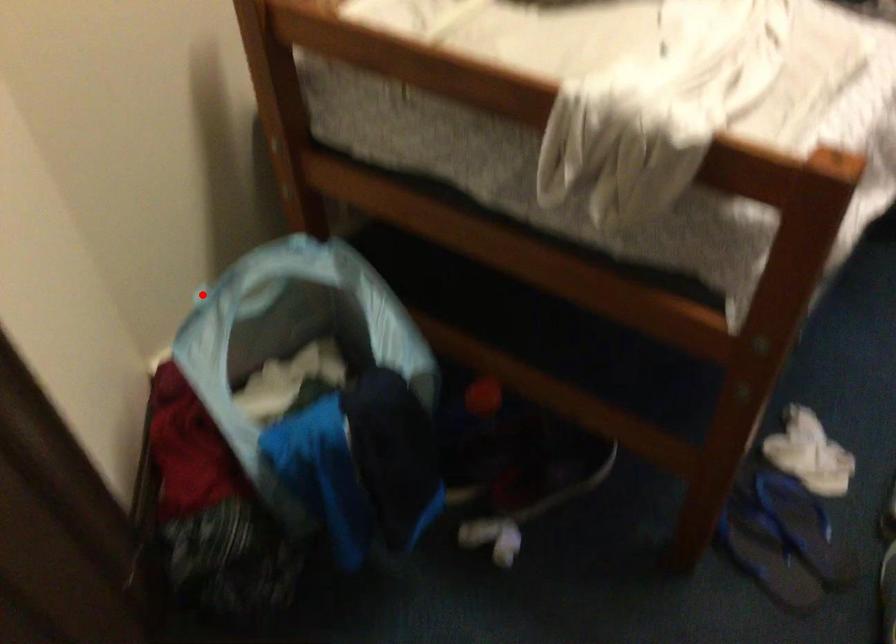
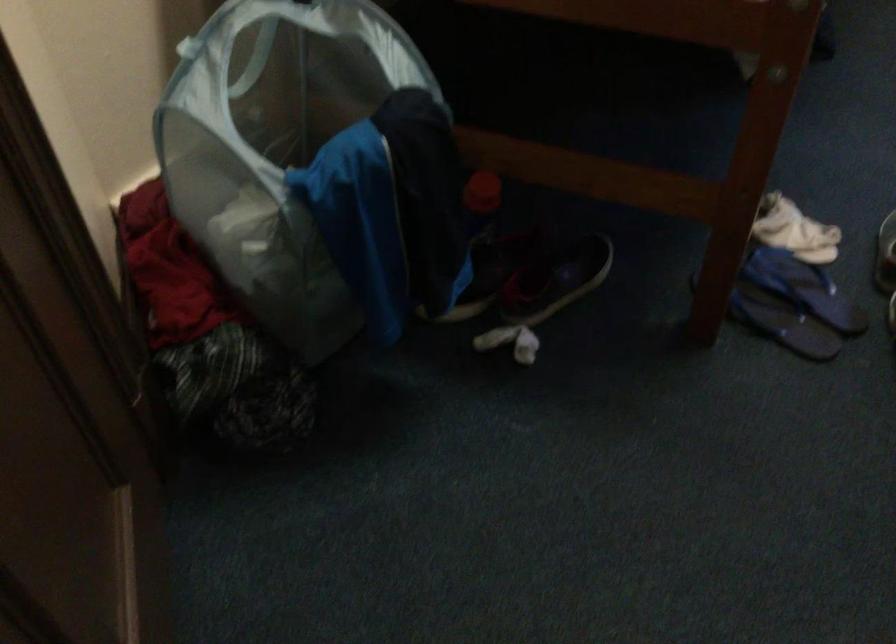
Where in the second image is the point corresponding to the highlighted location from the first image?

(186, 46)